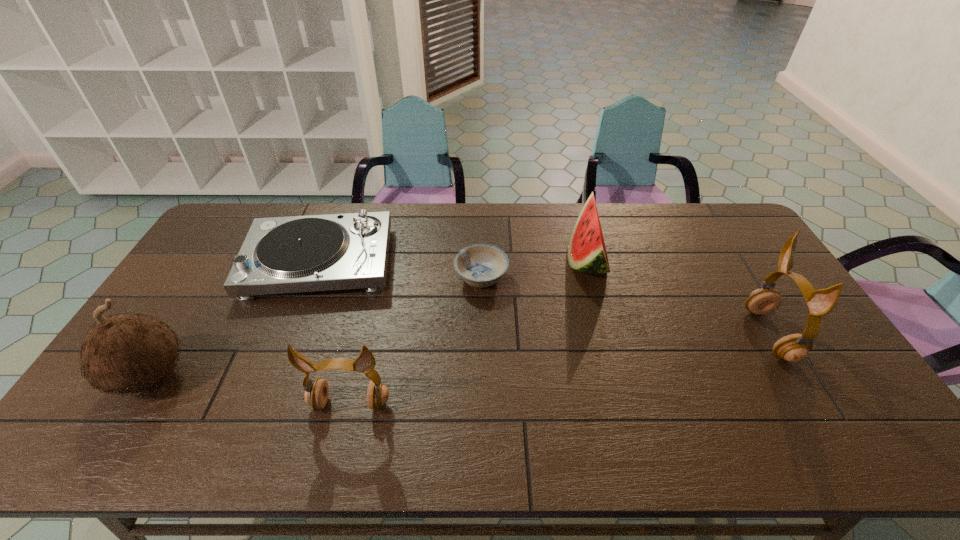
Point out which object is positioned as the nearest to the fifth object from left to right. Please provide its 2D coordinates. Your answer should be formatted as a tuple, i.e. [(x, y)], where the tuple contains the x and y coordinates of a point satisfying the conditions above.

[(480, 265)]

Select which object appears as the second closest to the coconut. Please provide its 2D coordinates. Your answer should be formatted as a tuple, i.e. [(x, y)], where the tuple contains the x and y coordinates of a point satisfying the conditions above.

[(316, 393)]

Find the location of `vacant position in the image that satisfies the following two spatial constraints: 1. on the outer rind of the watermelon; 2. on the front-facing side of the nearer earphone`. vacant position in the image that satisfies the following two spatial constraints: 1. on the outer rind of the watermelon; 2. on the front-facing side of the nearer earphone is located at coordinates (624, 403).

The width and height of the screenshot is (960, 540). Find the location of `vacant region that satisfies the following two spatial constraints: 1. on the front-facing side of the farther earphone; 2. on the front-facing side of the nearer earphone`. vacant region that satisfies the following two spatial constraints: 1. on the front-facing side of the farther earphone; 2. on the front-facing side of the nearer earphone is located at coordinates (810, 403).

I want to click on vacant space that satisfies the following two spatial constraints: 1. on the front-facing side of the rightmost object; 2. on the surface of the coconut, so click(x=794, y=376).

You are a GUI agent. You are given a task and a screenshot of the screen. Output one action in this format:
    pyautogui.click(x=<x>, y=<y>)
    Task: Click on the free point that satisfies the following two spatial constraints: 1. on the front-facing side of the rightmost object; 2. on the front-facing side of the nearer earphone
    
    Given the screenshot: What is the action you would take?
    pyautogui.click(x=810, y=403)